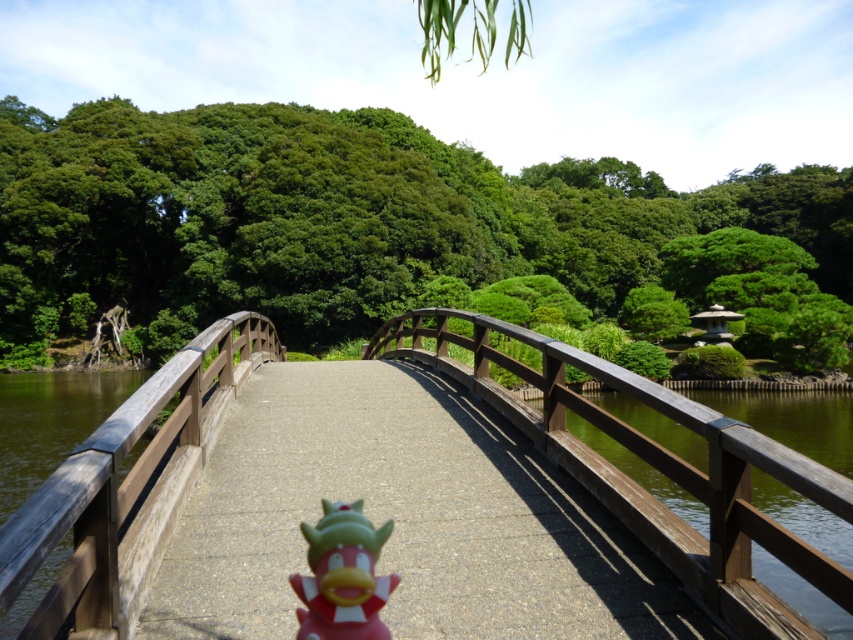
Which is more to the right, wooden bridge at center or wooden rail at center?

From the viewer's perspective, wooden bridge at center appears more on the right side.

Can you confirm if wooden bridge at center is thinner than wooden rail at center?

In fact, wooden bridge at center might be wider than wooden rail at center.

Who is more distant from viewer, (102, 564) or (102, 476)?

The point (102, 564) is behind.

Locate an element on the screen. Image resolution: width=853 pixels, height=640 pixels. wooden bridge at center is located at coordinates (651, 465).

Is wooden bridge at center to the left of pink rubber duck at center from the viewer's perspective?

Yes, wooden bridge at center is to the left of pink rubber duck at center.

Is the position of wooden bridge at center less distant than that of pink rubber duck at center?

Yes, it is in front of pink rubber duck at center.

Where is `wooden bridge at center`? Image resolution: width=853 pixels, height=640 pixels. wooden bridge at center is located at coordinates (651, 465).

Is wooden rail at center wider than pink rubber duck at center?

Yes.

What do you see at coordinates (128, 486) in the screenshot? The height and width of the screenshot is (640, 853). I see `wooden rail at center` at bounding box center [128, 486].

What are the coordinates of `wooden rail at center` in the screenshot? It's located at (128, 486).